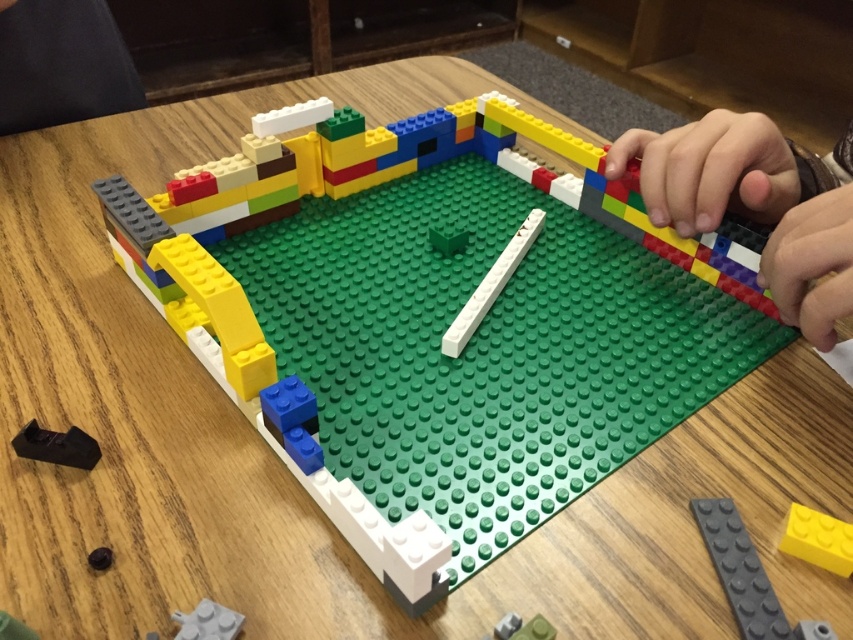
Is point (733, 525) in front of point (786, 538)?

That is False.

Is gray matte brick at bottom right smaller than yellow matte brick at center?

Incorrect, gray matte brick at bottom right is not smaller in size than yellow matte brick at center.

Does point (737, 618) come closer to viewer compared to point (846, 532)?

Yes, it is in front of point (846, 532).

Find the location of `gray matte brick at bottom right`. gray matte brick at bottom right is located at coordinates (746, 576).

Does gray matte brick at bottom right have a greater height compared to black plastic piece at lower left?

Yes, gray matte brick at bottom right is taller than black plastic piece at lower left.

Between gray matte brick at bottom right and black plastic piece at lower left, which one appears on the left side from the viewer's perspective?

A: Positioned to the left is black plastic piece at lower left.

Between point (689, 508) and point (47, 452), which one is positioned behind?

The point (689, 508) is behind.

Where is `gray matte brick at bottom right`? Image resolution: width=853 pixels, height=640 pixels. gray matte brick at bottom right is located at coordinates (746, 576).

Is smooth plastic hand at upper right wider than gray matte brick at bottom right?

Yes.

Which is more to the right, smooth plastic hand at upper right or gray matte brick at bottom right?

Positioned to the right is smooth plastic hand at upper right.

Between point (686, 209) and point (734, 580), which one is positioned behind?

Point (686, 209)

Where is `smooth plastic hand at upper right`? The image size is (853, 640). smooth plastic hand at upper right is located at coordinates (755, 204).